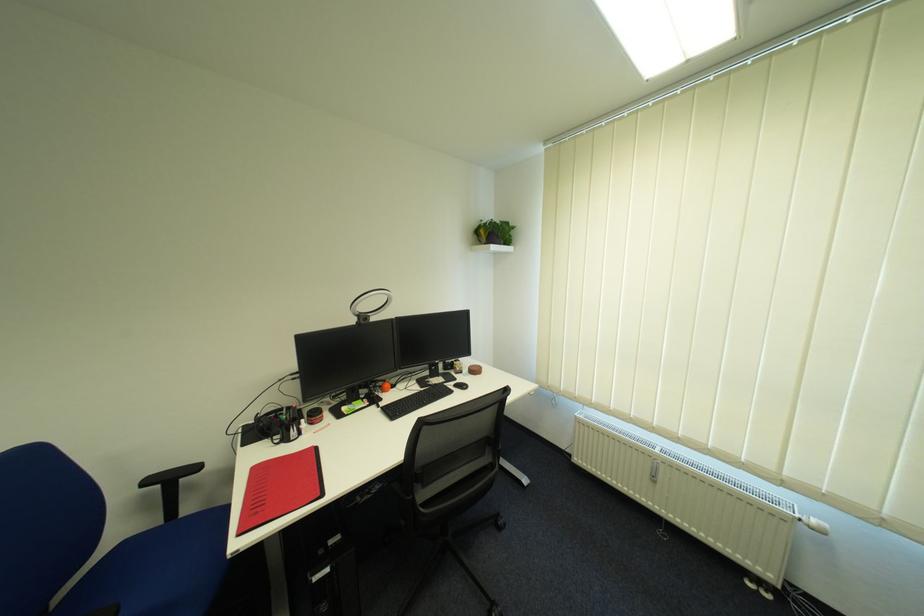
What do you see at coordinates (270, 422) in the screenshot? This screenshot has height=616, width=924. I see `the phone handset` at bounding box center [270, 422].